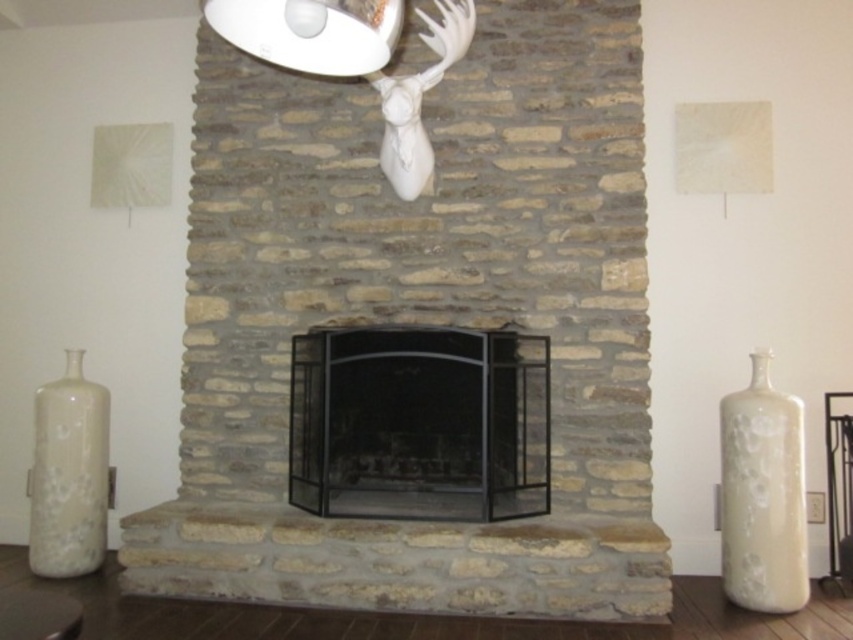
Locate an element on the screen. The image size is (853, 640). black metal fireplace at center is located at coordinates (419, 422).

Who is taller, black metal fireplace at center or white glossy lampshade at upper center?

Standing taller between the two is black metal fireplace at center.

Is point (318, 470) positioned behind point (390, 22)?

Yes, point (318, 470) is behind point (390, 22).

This screenshot has height=640, width=853. What are the coordinates of `black metal fireplace at center` in the screenshot? It's located at (419, 422).

Does white glossy vase at left appear under white glossy lampshade at upper center?

Yes, white glossy vase at left is below white glossy lampshade at upper center.

Locate an element on the screen. Image resolution: width=853 pixels, height=640 pixels. white glossy vase at left is located at coordinates click(68, 474).

Who is taller, black metal fireplace at center or white glossy vase at left?

white glossy vase at left is taller.

Can you confirm if black metal fireplace at center is wider than white glossy vase at left?

Yes.

I want to click on black metal fireplace at center, so click(x=419, y=422).